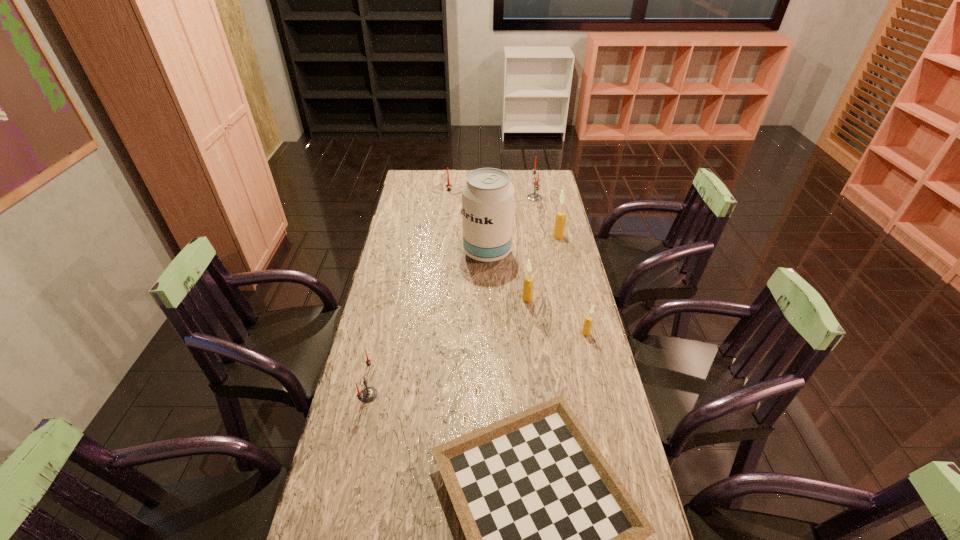
Where is `unoccupied area between the second nearest cream candle and the farthest cream candle`? The width and height of the screenshot is (960, 540). unoccupied area between the second nearest cream candle and the farthest cream candle is located at coordinates (542, 267).

Identify the location of free space between the smallest cream candle and the tallest object. pyautogui.click(x=537, y=293).

Find the location of a particular element. vacant area between the leftmost object and the nearest cream candle is located at coordinates (477, 364).

You are a GUI agent. You are given a task and a screenshot of the screen. Output one action in this format:
    pyautogui.click(x=<x>, y=<y>)
    Task: Click on the free space between the fourth nearest candle and the rightmost red candle
    The width and height of the screenshot is (960, 540).
    Given the screenshot: What is the action you would take?
    pyautogui.click(x=546, y=217)

In order to click on free space between the third farthest candle and the smallest cream candle in this screenshot , I will do `click(572, 285)`.

Find the location of a particular element. The image size is (960, 540). free space between the smallest cream candle and the fourth candle from left to right is located at coordinates (560, 265).

Identify the location of object that can be found as the fourth closest to the second candle from left to right. (528, 282).

Locate an element on the screen. This screenshot has width=960, height=540. object that stands as the fifth closest to the shortest object is located at coordinates (560, 219).

The image size is (960, 540). Find the location of `the third closest candle to the rightmost red candle`. the third closest candle to the rightmost red candle is located at coordinates (528, 282).

Select which candle is the second closest to the fourth candle from left to right. Please provide its 2D coordinates. Your answer should be formatted as a tuple, i.e. [(x, y)], where the tuple contains the x and y coordinates of a point satisfying the conditions above.

[(560, 219)]